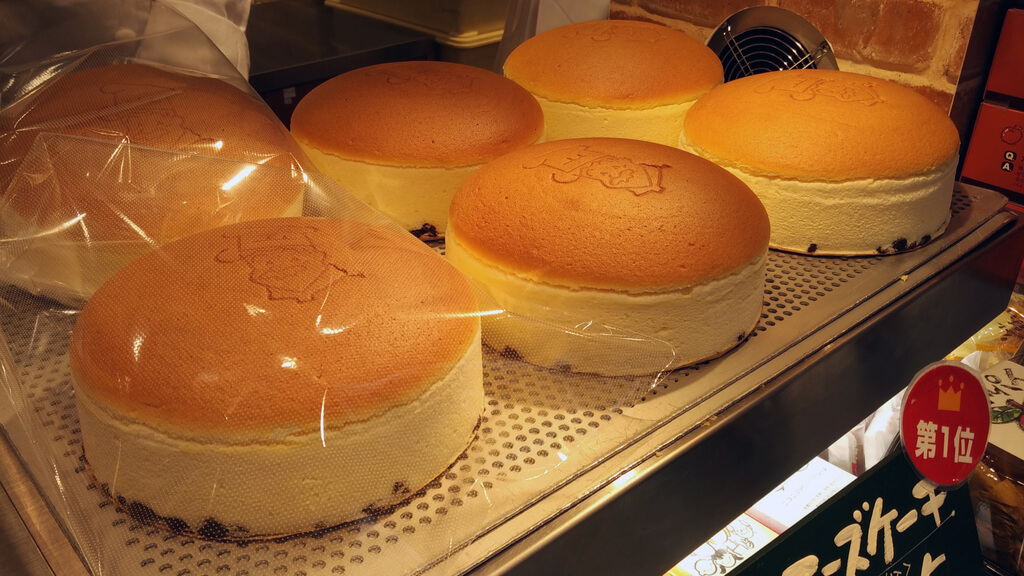
Locate an element on the screen. This screenshot has height=576, width=1024. fan is located at coordinates (761, 44).